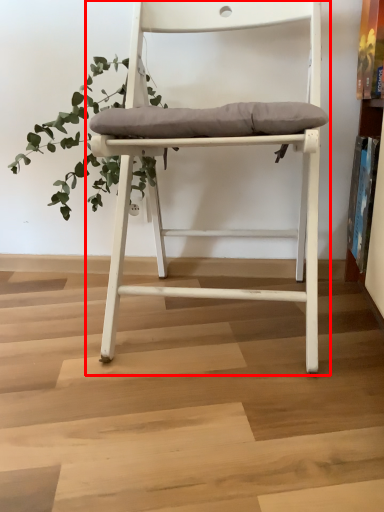
Question: Observing the image, what is the correct spatial positioning of chair (annotated by the red box) in reference to vegetation?

Choices:
 (A) right
 (B) left

Answer: (A)